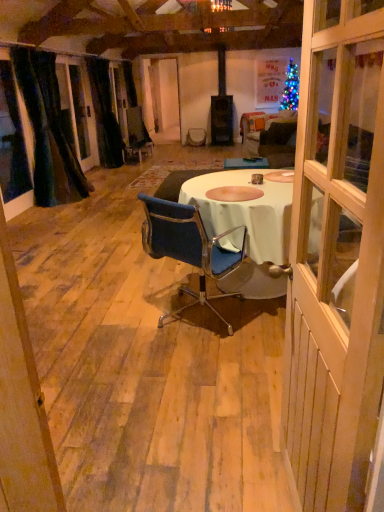
What do you see at coordinates (105, 114) in the screenshot? I see `black velvet curtain at left, positioned as the first curtain in back-to-front order` at bounding box center [105, 114].

Describe the element at coordinates (336, 258) in the screenshot. This screenshot has height=512, width=384. I see `wooden door at center` at that location.

I want to click on blue fabric chair at center, so click(188, 248).

How much space does velvety dark green curtain at left, acting as the 2th curtain starting from the back, occupy horizontally?

velvety dark green curtain at left, acting as the 2th curtain starting from the back, is 21.70 inches wide.

Find the location of a particular element. black velvet curtain at left, positioned as the first curtain in back-to-front order is located at coordinates (105, 114).

Can black velvet curtain at left, the second curtain from the front, be found inside blue fabric chair at center?

No, black velvet curtain at left, the second curtain from the front, is not inside blue fabric chair at center.

Which is behind, blue fabric chair at center or black velvet curtain at left, positioned as the first curtain in back-to-front order?

black velvet curtain at left, positioned as the first curtain in back-to-front order, is more distant.

Based on the photo, does blue fabric chair at center have a greater width compared to black velvet curtain at left, positioned as the first curtain in back-to-front order?

Indeed, blue fabric chair at center has a greater width compared to black velvet curtain at left, positioned as the first curtain in back-to-front order.

Is blue fabric chair at center not near black velvet curtain at left, the second curtain from the front?

Yes.

Is velvety dark green curtain at left, acting as the 2th curtain starting from the back, facing towards wooden door at center?

No, velvety dark green curtain at left, acting as the 2th curtain starting from the back, does not turn towards wooden door at center.

Is point (70, 178) behind point (320, 377)?

Yes, it is behind point (320, 377).

Is wooden door at center located within velvety dark green curtain at left, acting as the 2th curtain starting from the back?

No, wooden door at center is not surrounded by velvety dark green curtain at left, acting as the 2th curtain starting from the back.

Image resolution: width=384 pixels, height=512 pixels. In order to click on door on the right of velvety dark green curtain at left, arranged as the first curtain when viewed from the front in this screenshot , I will do `click(336, 258)`.

Looking at this image, can you confirm if velvety dark green curtain at left, acting as the 2th curtain starting from the back, is smaller than blue fabric chair at center?

No.

Would you say velvety dark green curtain at left, acting as the 2th curtain starting from the back, is inside or outside blue fabric chair at center?

velvety dark green curtain at left, acting as the 2th curtain starting from the back, is located beyond the bounds of blue fabric chair at center.

Is velvety dark green curtain at left, acting as the 2th curtain starting from the back, not near blue fabric chair at center?

That's right, there is a large distance between velvety dark green curtain at left, acting as the 2th curtain starting from the back, and blue fabric chair at center.

Would you say black velvet curtain at left, the second curtain from the front, is to the left or to the right of wooden door at center in the picture?

Based on their positions, black velvet curtain at left, the second curtain from the front, is located to the left of wooden door at center.

Consider the image. Is black velvet curtain at left, positioned as the first curtain in back-to-front order, further to the viewer compared to wooden door at center?

Yes, black velvet curtain at left, positioned as the first curtain in back-to-front order, is further from the camera.

Is there a large distance between black velvet curtain at left, the second curtain from the front, and wooden door at center?

Absolutely, black velvet curtain at left, the second curtain from the front, is distant from wooden door at center.

Where is `chair on the left side of wooden door at center`? chair on the left side of wooden door at center is located at coordinates (188, 248).

Which is behind, wooden door at center or blue fabric chair at center?

blue fabric chair at center.

Is wooden door at center directly adjacent to blue fabric chair at center?

No, wooden door at center is not beside blue fabric chair at center.

The height and width of the screenshot is (512, 384). Identify the location of chair that is on the right side of black velvet curtain at left, the second curtain from the front. click(x=188, y=248).

Which of these two, black velvet curtain at left, positioned as the first curtain in back-to-front order, or blue fabric chair at center, is smaller?

Smaller between the two is blue fabric chair at center.

Between point (98, 138) and point (183, 230), which one is positioned in front?

Point (183, 230)

Which is in front, point (330, 164) or point (98, 135)?

The point (330, 164) is more forward.

Would you say wooden door at center contains black velvet curtain at left, the second curtain from the front?

No, black velvet curtain at left, the second curtain from the front, is located outside of wooden door at center.

You are a GUI agent. You are given a task and a screenshot of the screen. Output one action in this format:
    pyautogui.click(x=<x>, y=<y>)
    Task: Click on the door that is in front of the black velvet curtain at left, positioned as the first curtain in back-to-front order
    
    Given the screenshot: What is the action you would take?
    pyautogui.click(x=336, y=258)

Is wooden door at center aimed at black velvet curtain at left, positioned as the first curtain in back-to-front order?

No, wooden door at center is not facing towards black velvet curtain at left, positioned as the first curtain in back-to-front order.

Which curtain is the 2nd one when counting from the back of the blue fabric chair at center? Please provide its 2D coordinates.

[(105, 114)]

You are a GUI agent. You are given a task and a screenshot of the screen. Output one action in this format:
    pyautogui.click(x=<x>, y=<y>)
    Task: Click on the 1st curtain positioned above the wooden door at center (from the image's perspective)
    The width and height of the screenshot is (384, 512).
    Given the screenshot: What is the action you would take?
    pyautogui.click(x=48, y=130)

Considering their positions, is blue fabric chair at center positioned further to black velvet curtain at left, positioned as the first curtain in back-to-front order, than velvety dark green curtain at left, arranged as the first curtain when viewed from the front?

Among the two, blue fabric chair at center is located further to black velvet curtain at left, positioned as the first curtain in back-to-front order.

When comparing their distances from blue fabric chair at center, does wooden door at center or black velvet curtain at left, the second curtain from the front, seem closer?

Among the two, wooden door at center is located nearer to blue fabric chair at center.

When comparing their distances from velvety dark green curtain at left, arranged as the first curtain when viewed from the front, does blue fabric chair at center or wooden door at center seem closer?

Among the two, blue fabric chair at center is located nearer to velvety dark green curtain at left, arranged as the first curtain when viewed from the front.

Which object lies nearer to the anchor point wooden door at center, blue fabric chair at center or velvety dark green curtain at left, acting as the 2th curtain starting from the back?

The object closer to wooden door at center is blue fabric chair at center.

When comparing their distances from blue fabric chair at center, does black velvet curtain at left, positioned as the first curtain in back-to-front order, or velvety dark green curtain at left, acting as the 2th curtain starting from the back, seem closer?

Among the two, velvety dark green curtain at left, acting as the 2th curtain starting from the back, is located nearer to blue fabric chair at center.

Estimate the real-world distances between objects in this image. Which object is closer to velvety dark green curtain at left, arranged as the first curtain when viewed from the front, wooden door at center or black velvet curtain at left, positioned as the first curtain in back-to-front order?

black velvet curtain at left, positioned as the first curtain in back-to-front order, is closer to velvety dark green curtain at left, arranged as the first curtain when viewed from the front.

Based on the photo, estimate the real-world distances between objects in this image. Which object is closer to wooden door at center, black velvet curtain at left, the second curtain from the front, or blue fabric chair at center?

blue fabric chair at center is positioned closer to the anchor wooden door at center.

Considering their positions, is wooden door at center positioned further to velvety dark green curtain at left, acting as the 2th curtain starting from the back, than blue fabric chair at center?

wooden door at center lies further to velvety dark green curtain at left, acting as the 2th curtain starting from the back, than the other object.

Find the location of a particular element. The height and width of the screenshot is (512, 384). chair between wooden door at center and velvety dark green curtain at left, arranged as the first curtain when viewed from the front, in the front-back direction is located at coordinates (188, 248).

This screenshot has width=384, height=512. What are the coordinates of `chair located between wooden door at center and black velvet curtain at left, positioned as the first curtain in back-to-front order, in the depth direction` in the screenshot? It's located at (188, 248).

Locate an element on the screen. The height and width of the screenshot is (512, 384). curtain between blue fabric chair at center and black velvet curtain at left, the second curtain from the front, from front to back is located at coordinates (48, 130).

Locate an element on the screen. curtain between wooden door at center and black velvet curtain at left, the second curtain from the front, along the z-axis is located at coordinates (48, 130).